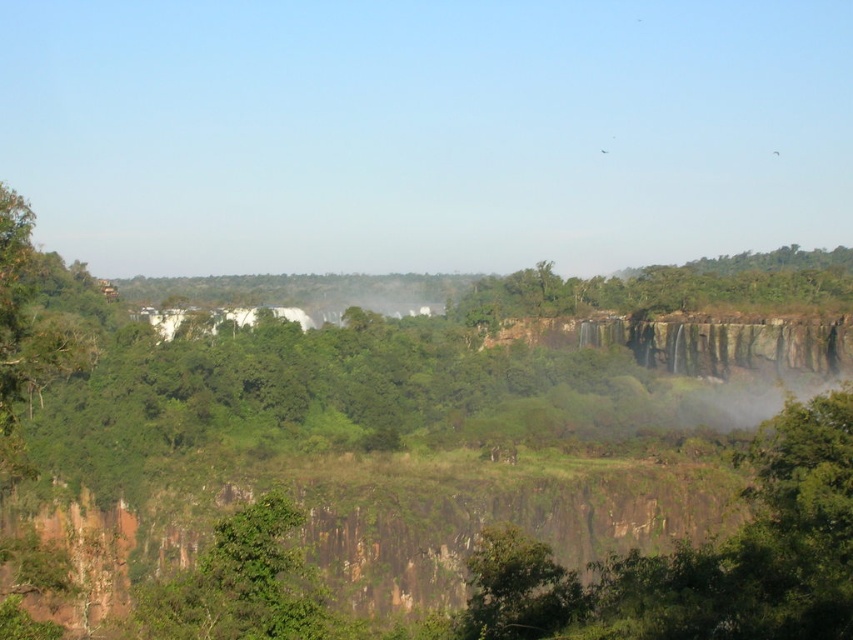
Question: Is green leafy tree at upper center positioned behind green leafy tree at center?

Choices:
 (A) yes
 (B) no

Answer: (A)

Question: Which point appears closest to the camera in this image?

Choices:
 (A) (844, 268)
 (B) (222, 564)

Answer: (B)

Question: Is green leafy tree at upper center positioned at the back of green leafy tree at center?

Choices:
 (A) no
 (B) yes

Answer: (B)

Question: Among these points, which one is nearest to the camera?

Choices:
 (A) (834, 296)
 (B) (221, 612)

Answer: (B)

Question: Which of the following is the closest to the observer?

Choices:
 (A) green leafy tree at center
 (B) green leafy tree at upper center

Answer: (A)

Question: From the image, what is the correct spatial relationship of green leafy tree at upper center in relation to green leafy tree at center?

Choices:
 (A) left
 (B) right

Answer: (B)